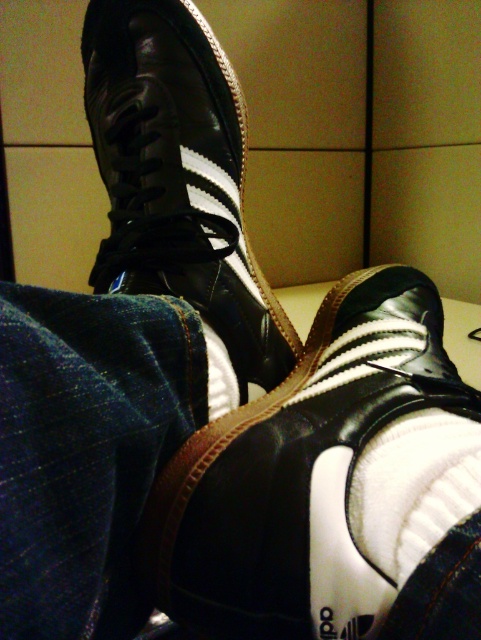
You are standing in front of the beige wall and see the black leather shoe at center and the white fluffy sock at center. Which object is positioned to the right?

The white fluffy sock at center is positioned to the right of the black leather shoe at center.

You are an interior designer trying to place a decorative item on the beige wall. You want to position it exactly where the black leather shoe at upper center is currently located. According to the image, what are the coordinates for this position?

The coordinates for the position where the black leather shoe at upper center is located are at point (177, 177).

You are trying to decide which item to place in a small storage box. Given the sizes of the black leather shoe at center and the white fluffy sock at center, which one will fit better in the box?

The white fluffy sock at center will fit better in the small storage box because the black leather shoe at center is larger in size than the white fluffy sock at center.